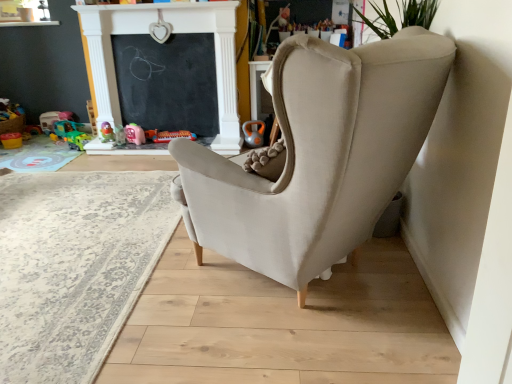
Locate an element on the screen. vacant point above black chalkboard at upper center (from a real-world perspective) is located at coordinates (160, 33).